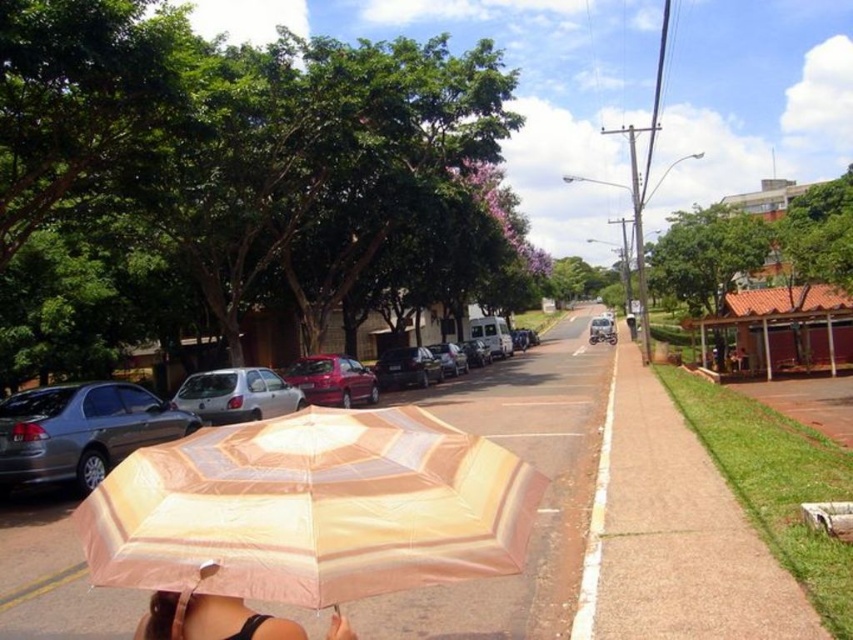
Question: Among these objects, which one is farthest from the camera?

Choices:
 (A) pink fabric umbrella at lower left
 (B) glossy red car at center

Answer: (B)

Question: Which object appears closest to the camera in this image?

Choices:
 (A) silver metallic van at center
 (B) shiny black car at center
 (C) white matte hatchback at center
 (D) beige striped umbrella at center

Answer: (D)

Question: Which object appears farthest from the camera in this image?

Choices:
 (A) matte gray sedan at left
 (B) pink fabric umbrella at lower left
 (C) beige striped umbrella at center
 (D) white matte hatchback at center

Answer: (D)

Question: In this image, where is shiny silver sedan at center located relative to silver metallic van at center?

Choices:
 (A) left
 (B) right

Answer: (A)

Question: Considering the relative positions of pink fabric umbrella at lower left and shiny silver sedan at center in the image provided, where is pink fabric umbrella at lower left located with respect to shiny silver sedan at center?

Choices:
 (A) below
 (B) above

Answer: (B)

Question: Is beige striped umbrella at center wider than shiny black car at center?

Choices:
 (A) yes
 (B) no

Answer: (A)